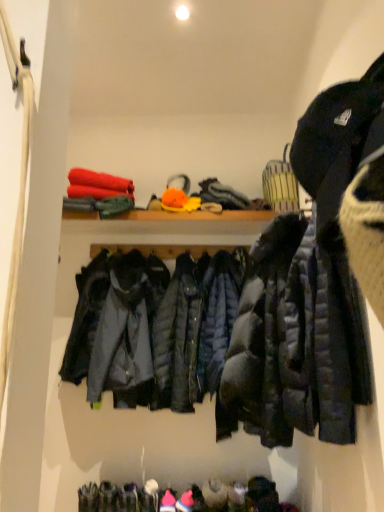
Question: From the image's perspective, relative to matte black puffer jacket at right, which is the second jacket in left-to-right order, is matte black jacket at center, placed as the 2th jacket when sorted from front to back, above or below?

Choices:
 (A) above
 (B) below

Answer: (B)

Question: From a real-world perspective, is matte black jacket at center, which is the 2th jacket from right to left, physically located above or below matte black puffer jacket at right, marked as the 1th jacket in a front-to-back arrangement?

Choices:
 (A) below
 (B) above

Answer: (A)

Question: Looking at their shapes, would you say matte black jacket at center, placed as the 2th jacket when sorted from front to back, is wider or thinner than matte black puffer jacket at right, marked as the 1th jacket in a front-to-back arrangement?

Choices:
 (A) thin
 (B) wide

Answer: (A)

Question: Relative to matte black jacket at center, placed as the first jacket when sorted from back to front, is matte black puffer jacket at right, marked as the 1th jacket in a front-to-back arrangement, in front or behind?

Choices:
 (A) front
 (B) behind

Answer: (A)

Question: In terms of height, does matte black puffer jacket at right, which is the second jacket in left-to-right order, look taller or shorter compared to matte black jacket at center, placed as the 2th jacket when sorted from front to back?

Choices:
 (A) short
 (B) tall

Answer: (B)

Question: From a real-world perspective, relative to matte black jacket at center, placed as the first jacket when sorted from back to front, is matte black puffer jacket at right, which is counted as the second jacket, starting from the back, vertically above or below?

Choices:
 (A) above
 (B) below

Answer: (A)

Question: Visually, is matte black puffer jacket at right, marked as the 1th jacket in a front-to-back arrangement, positioned to the left or to the right of matte black jacket at center, placed as the 2th jacket when sorted from front to back?

Choices:
 (A) left
 (B) right

Answer: (B)